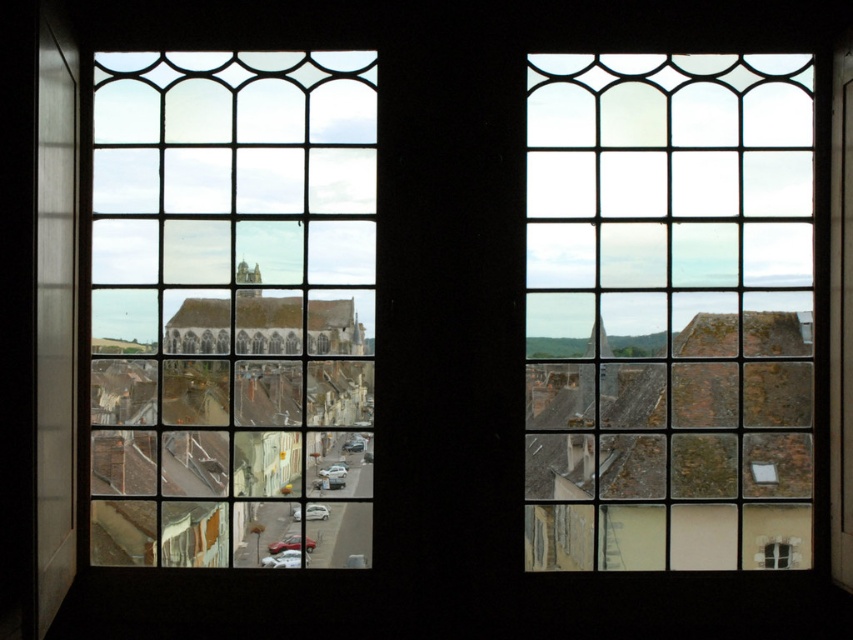
Looking at this image, you are an interior designer assessing the lighting in a room with two clear glass windows. The clear glass window at upper right and the clear glass window at center are both present. Which window allows more natural light into the room?

The clear glass window at center allows more natural light into the room because it has a larger size compared to the clear glass window at upper right.